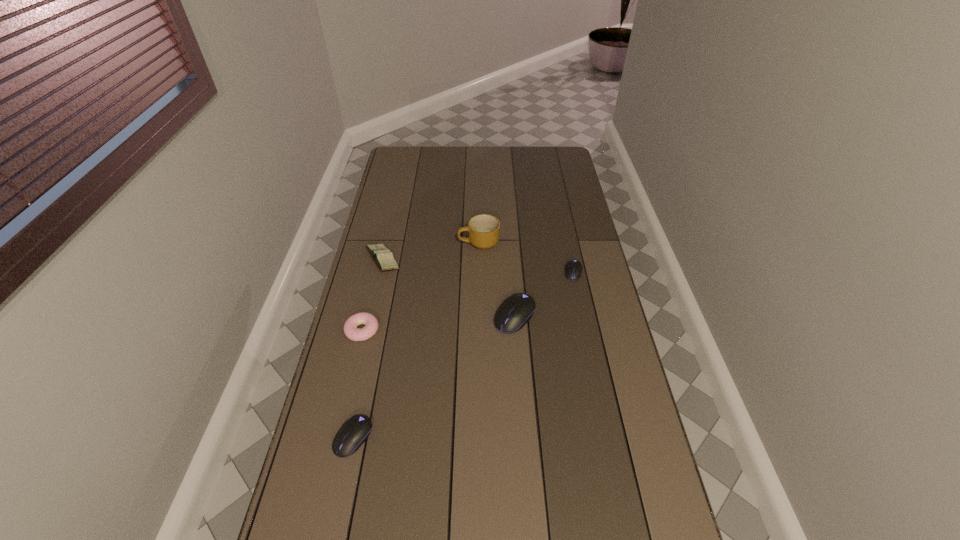
To achieve uniform spacing by inserting another mouse_(computer_equipment) among them, please point to a free space for this new mouse_(computer_equipment). Please provide its 2D coordinates. Your answer should be formatted as a tuple, i.e. [(x, y)], where the tuple contains the x and y coordinates of a point satisfying the conditions above.

[(444, 370)]